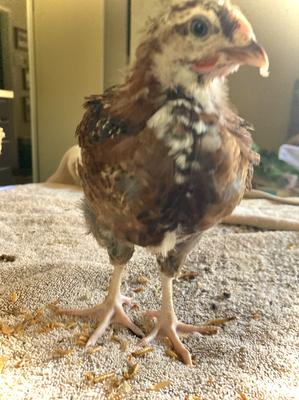
You are a GUI agent. You are given a task and a screenshot of the screen. Output one action in this format:
    pyautogui.click(x=<x>, y=<y>)
    Task: Click on the fabric
    
    Given the screenshot: What is the action you would take?
    pyautogui.click(x=260, y=337)